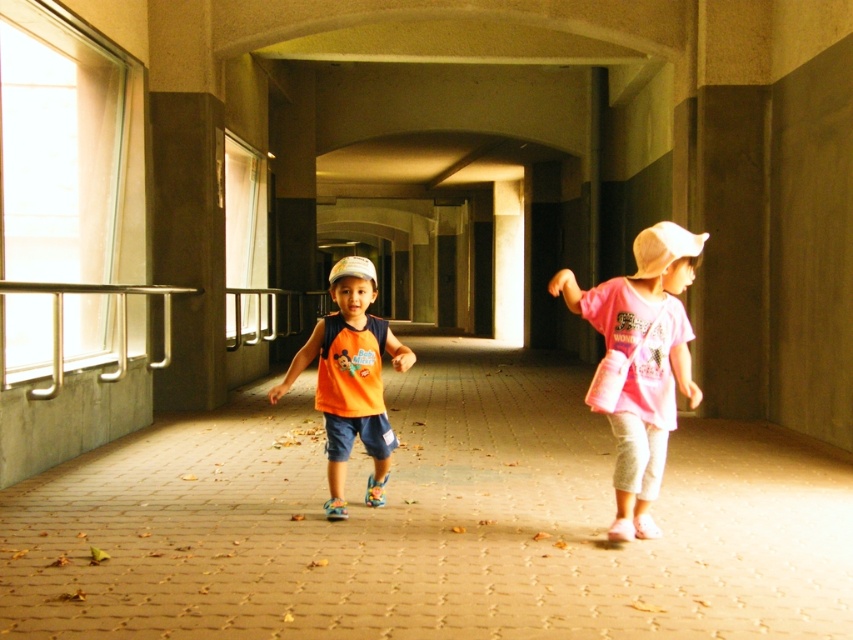
You are a photographer standing in the covered walkway. You want to take a photo of the pink cotton shirt at right and the orange matte tank top at center. Which object is positioned higher in the frame?

The pink cotton shirt at right is located above the orange matte tank top at center, so it is positioned higher in the frame.

You are a photographer standing at the entrance of the covered walkway. You notice the brown brick pavement at center and the pink cotton shirt at right. Which object is closer to the left side of the walkway?

The brown brick pavement at center is positioned on the left side of pink cotton shirt at right, so it is closer to the left side of the walkway.

You are a photographer wanting to capture the pink cotton shirt at right and the brown brick pavement at center in the same frame. Which object should you focus on first if you want to ensure both are in focus without adjusting the camera settings?

The brown brick pavement at center is larger in size than the pink cotton shirt at right, so focusing on the larger object first would help maintain focus on both.